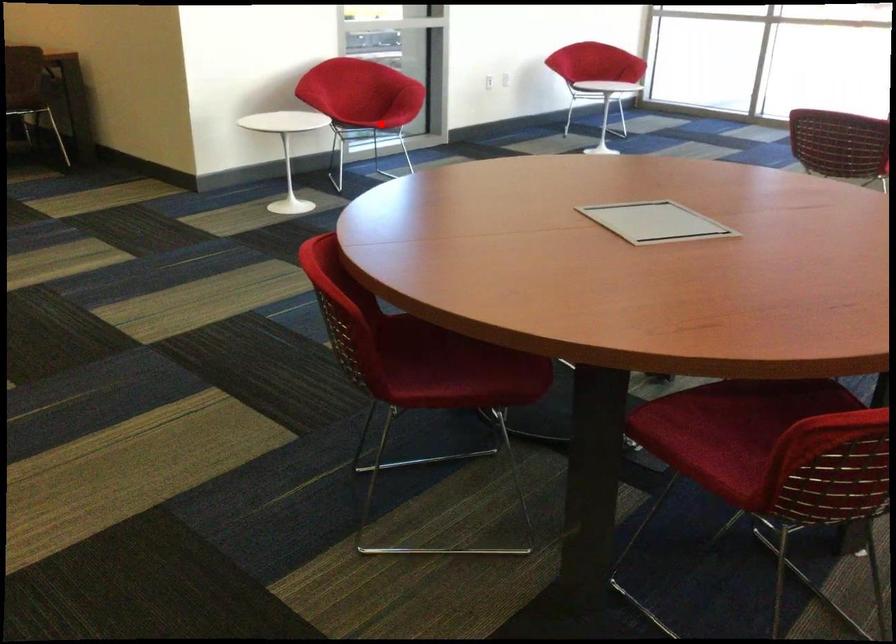
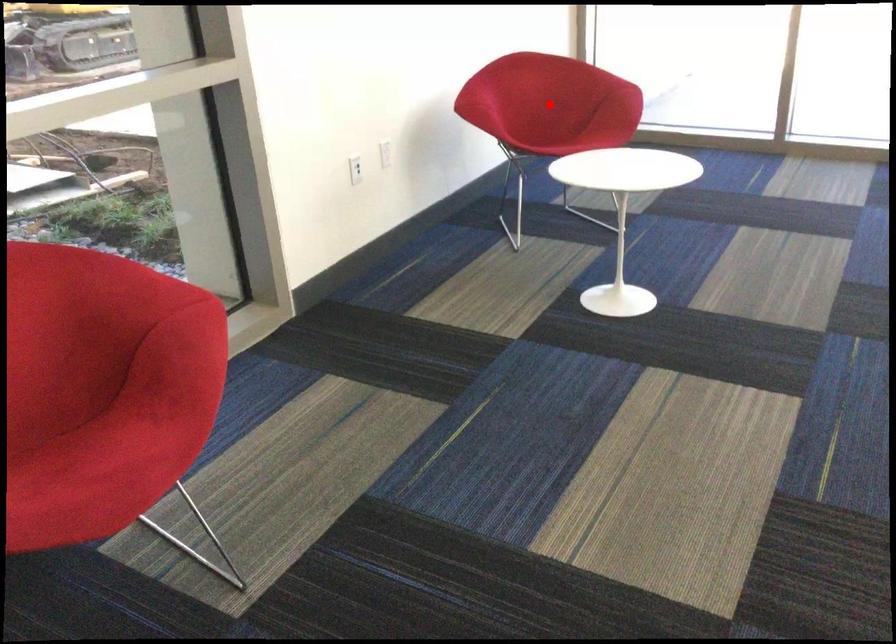
I am providing you with two images of the same scene from different viewpoints. A red point is marked on the first image and another point is marked on the second image. Do the highlighted points in image1 and image2 indicate the same real-world spot?

No